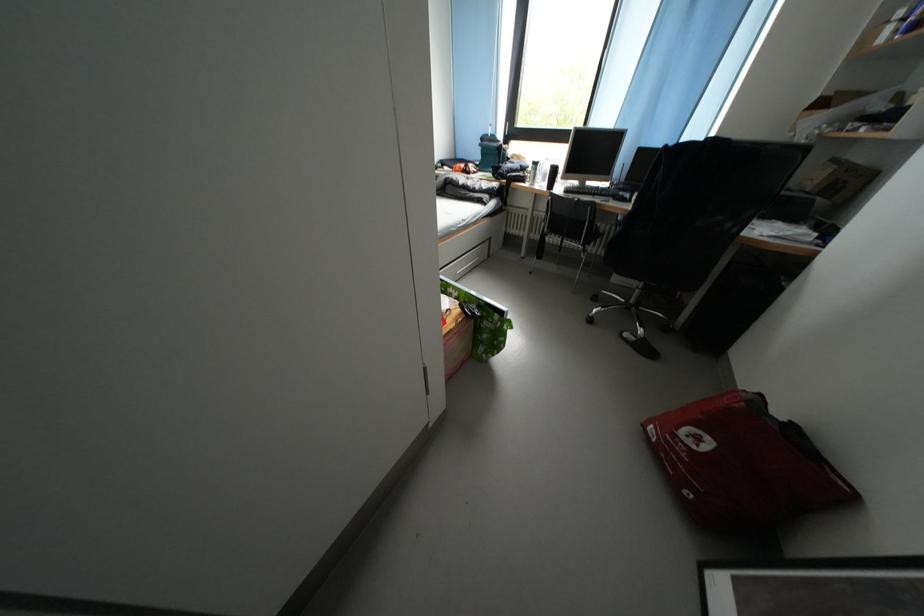
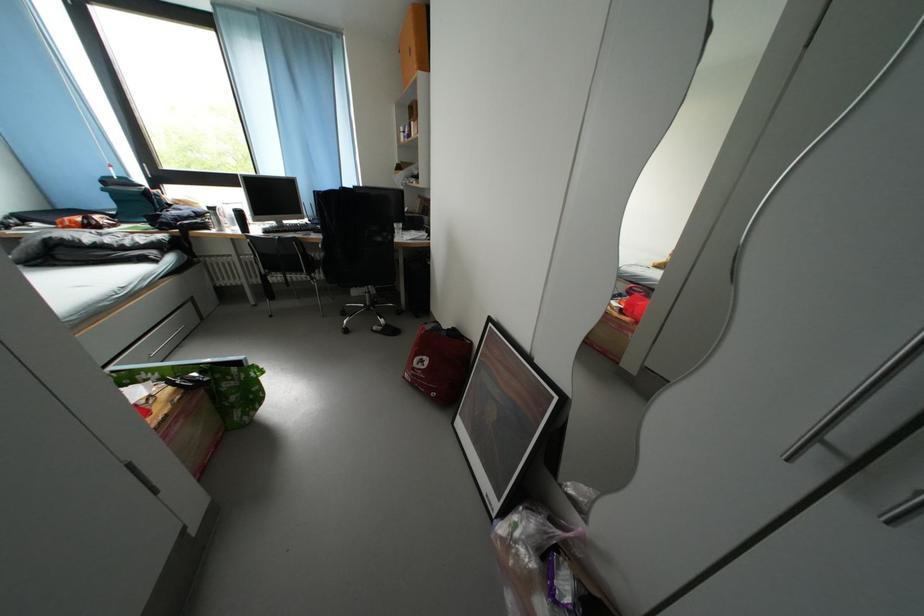
Find the pixel in the second image that matches the point at 634,339 in the first image.

(383, 333)